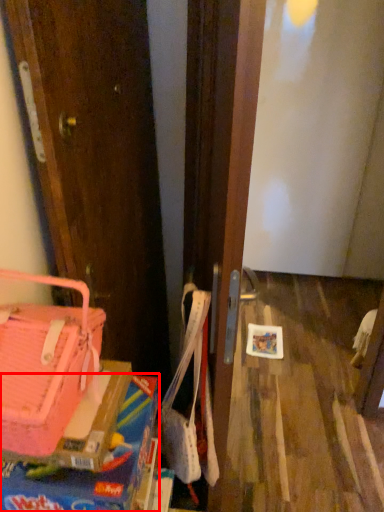
Question: From the image's perspective, where is box (annotated by the red box) located in relation to handbag in the image?

Choices:
 (A) below
 (B) above

Answer: (A)